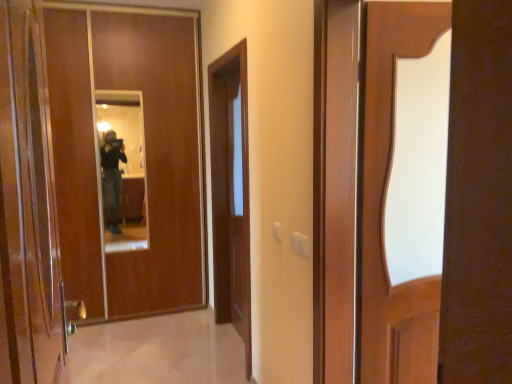
The width and height of the screenshot is (512, 384). What do you see at coordinates (29, 209) in the screenshot?
I see `shiny brown door at left, the 1th door positioned from the front` at bounding box center [29, 209].

Locate an element on the screen. The width and height of the screenshot is (512, 384). shiny brown door at left, the 2th door positioned from the back is located at coordinates (29, 209).

Identify the location of the 2nd door counting from the left side of the brown wooden door at center. (127, 158).

Is brown wooden door at center facing towards matte wood door at left, which ranks as the second door in front-to-back order?

No, brown wooden door at center is not facing towards matte wood door at left, which ranks as the second door in front-to-back order.

Is brown wooden door at center directly adjacent to matte wood door at left, the 1th door positioned from the back?

brown wooden door at center and matte wood door at left, the 1th door positioned from the back, are not in contact.

Is matte wood door at left, which ranks as the second door in front-to-back order, not within brown wooden door at center?

matte wood door at left, which ranks as the second door in front-to-back order, is positioned outside brown wooden door at center.

From a real-world perspective, is matte wood door at left, which ranks as the second door in front-to-back order, above or below brown wooden door at center?

From a real-world perspective, matte wood door at left, which ranks as the second door in front-to-back order, is physically above brown wooden door at center.

Considering the relative positions of matte wood door at left, the 1th door positioned from the back, and brown wooden door at center in the image provided, is matte wood door at left, the 1th door positioned from the back, to the left of brown wooden door at center from the viewer's perspective?

Correct, you'll find matte wood door at left, the 1th door positioned from the back, to the left of brown wooden door at center.

Can you see matte wood door at left, which ranks as the second door in front-to-back order, touching brown wooden door at center?

matte wood door at left, which ranks as the second door in front-to-back order, and brown wooden door at center are clearly separated.

Considering the relative sizes of matte wooden mirror at center and brown wooden door at center in the image provided, is matte wooden mirror at center taller than brown wooden door at center?

No, matte wooden mirror at center is not taller than brown wooden door at center.

Is matte wooden mirror at center located outside brown wooden door at center?

Yes, matte wooden mirror at center is outside of brown wooden door at center.

How distant is matte wooden mirror at center from brown wooden door at center?

matte wooden mirror at center and brown wooden door at center are 3.62 feet apart from each other.

From a real-world perspective, is matte wooden mirror at center located beneath brown wooden door at center?

No, from a real-world perspective, matte wooden mirror at center is not beneath brown wooden door at center.

How much distance is there between shiny brown door at left, the 1th door positioned from the front, and matte wood door at left, the 1th door positioned from the back?

The distance of shiny brown door at left, the 1th door positioned from the front, from matte wood door at left, the 1th door positioned from the back, is 8.14 feet.

Which is in front, point (29, 342) or point (71, 112)?

The point (29, 342) is closer to the camera.

From a real-world perspective, is shiny brown door at left, the 2th door positioned from the back, physically located above or below matte wood door at left, which ranks as the second door in front-to-back order?

Clearly, from a real-world perspective, shiny brown door at left, the 2th door positioned from the back, is above matte wood door at left, which ranks as the second door in front-to-back order.

Is shiny brown door at left, the 1th door positioned from the front, aimed at matte wood door at left, which ranks as the second door in front-to-back order?

No, shiny brown door at left, the 1th door positioned from the front, does not turn towards matte wood door at left, which ranks as the second door in front-to-back order.

Which point is more distant from viewer, (x=153, y=40) or (x=3, y=227)?

The point (x=153, y=40) is farther from the camera.

Between matte wood door at left, the 1th door positioned from the back, and shiny brown door at left, the 2th door positioned from the back, which one has smaller width?

matte wood door at left, the 1th door positioned from the back, is thinner.

In the scene shown: Who is shorter, matte wood door at left, the 1th door positioned from the back, or shiny brown door at left, the 1th door positioned from the front?

shiny brown door at left, the 1th door positioned from the front.

Is matte wood door at left, which ranks as the second door in front-to-back order, bigger than shiny brown door at left, the 2th door positioned from the back?

Yes, matte wood door at left, which ranks as the second door in front-to-back order, is bigger than shiny brown door at left, the 2th door positioned from the back.

Is matte wooden mirror at center wider than shiny brown door at left, the 2th door positioned from the back?

Incorrect, the width of matte wooden mirror at center does not surpass that of shiny brown door at left, the 2th door positioned from the back.

Is matte wooden mirror at center not close to shiny brown door at left, the 1th door positioned from the front?

Yes, matte wooden mirror at center and shiny brown door at left, the 1th door positioned from the front, are located far from each other.

Which is behind, point (130, 154) or point (46, 172)?

The point (130, 154) is farther.

Is shiny brown door at left, the 1th door positioned from the front, inside matte wooden mirror at center?

Definitely not — shiny brown door at left, the 1th door positioned from the front, is not inside matte wooden mirror at center.

How many degrees apart are the facing directions of shiny brown door at left, the 1th door positioned from the front, and brown wooden door at center?

shiny brown door at left, the 1th door positioned from the front, and brown wooden door at center are facing 180 degrees away from each other.

Considering the sizes of objects shiny brown door at left, the 1th door positioned from the front, and brown wooden door at center in the image provided, who is taller, shiny brown door at left, the 1th door positioned from the front, or brown wooden door at center?

brown wooden door at center is taller.

The height and width of the screenshot is (384, 512). Identify the location of door in front of the brown wooden door at center. (29, 209).

Are shiny brown door at left, the 2th door positioned from the back, and brown wooden door at center making contact?

shiny brown door at left, the 2th door positioned from the back, and brown wooden door at center are not in contact.

This screenshot has width=512, height=384. Find the location of `screen door below the matte wood door at left, the 1th door positioned from the back (from the image's perspective)`. screen door below the matte wood door at left, the 1th door positioned from the back (from the image's perspective) is located at coordinates click(230, 194).

Where is `door behind the brown wooden door at center`? door behind the brown wooden door at center is located at coordinates (127, 158).

Estimate the real-world distances between objects in this image. Which object is closer to matte wooden mirror at center, matte wood door at left, which ranks as the second door in front-to-back order, or shiny brown door at left, the 2th door positioned from the back?

matte wood door at left, which ranks as the second door in front-to-back order.

Looking at the image, which one is located closer to matte wooden mirror at center, shiny brown door at left, the 2th door positioned from the back, or brown wooden door at center?

brown wooden door at center is closer to matte wooden mirror at center.

When comparing their distances from matte wooden mirror at center, does shiny brown door at left, the 2th door positioned from the back, or matte wood door at left, the 1th door positioned from the back, seem closer?

matte wood door at left, the 1th door positioned from the back, is closer to matte wooden mirror at center.

Considering their positions, is shiny brown door at left, the 2th door positioned from the back, positioned closer to matte wood door at left, the 1th door positioned from the back, than matte wooden mirror at center?

matte wooden mirror at center.

From the image, which object appears to be farther from matte wooden mirror at center, matte wood door at left, the 1th door positioned from the back, or brown wooden door at center?

Based on the image, brown wooden door at center appears to be further to matte wooden mirror at center.

Estimate the real-world distances between objects in this image. Which object is further from matte wood door at left, the 1th door positioned from the back, matte wooden mirror at center or brown wooden door at center?

brown wooden door at center is further to matte wood door at left, the 1th door positioned from the back.

Estimate the real-world distances between objects in this image. Which object is closer to shiny brown door at left, the 2th door positioned from the back, matte wood door at left, the 1th door positioned from the back, or brown wooden door at center?

The object closer to shiny brown door at left, the 2th door positioned from the back, is brown wooden door at center.

Which object lies further to the anchor point matte wooden mirror at center, brown wooden door at center or matte wood door at left, the 1th door positioned from the back?

Among the two, brown wooden door at center is located further to matte wooden mirror at center.

Where is `screen door positioned between shiny brown door at left, the 1th door positioned from the front, and matte wood door at left, which ranks as the second door in front-to-back order, from near to far`? screen door positioned between shiny brown door at left, the 1th door positioned from the front, and matte wood door at left, which ranks as the second door in front-to-back order, from near to far is located at coordinates (230, 194).

Find the location of a particular element. The image size is (512, 384). door between shiny brown door at left, the 2th door positioned from the back, and matte wooden mirror at center, along the z-axis is located at coordinates (127, 158).

The image size is (512, 384). What are the coordinates of `screen door located between shiny brown door at left, the 1th door positioned from the front, and matte wooden mirror at center in the depth direction` in the screenshot? It's located at (230, 194).